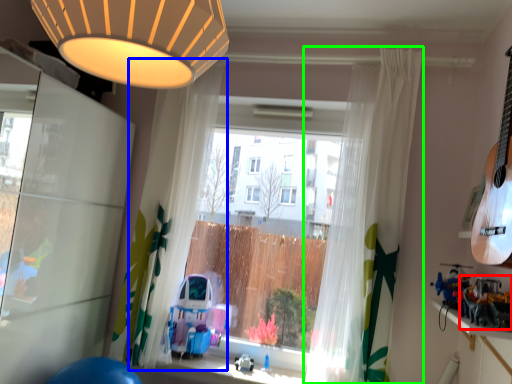
Question: Which object is the closest to the toy (highlighted by a red box)? Choose among these: curtain (highlighted by a blue box) or curtain (highlighted by a green box).

Choices:
 (A) curtain
 (B) curtain

Answer: (B)